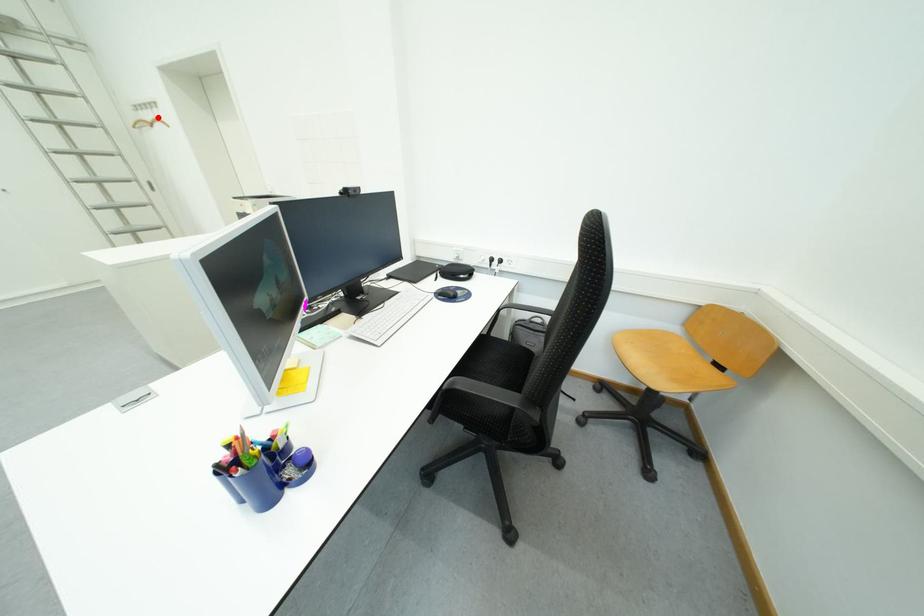
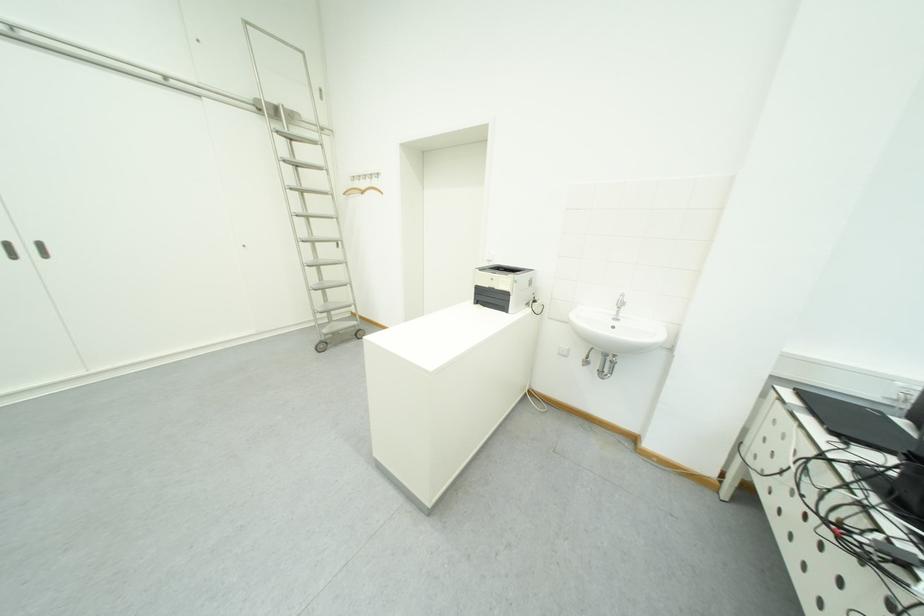
Find the pixel in the second image that matches the highlighted location in the first image.

(372, 185)